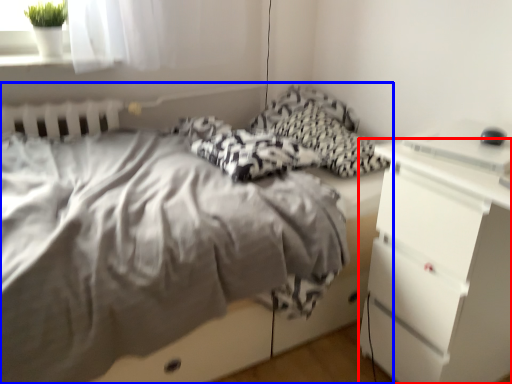
Question: Which point is closer to the camera, chest of drawers (highlighted by a red box) or bed (highlighted by a blue box)?

Choices:
 (A) chest of drawers
 (B) bed

Answer: (B)